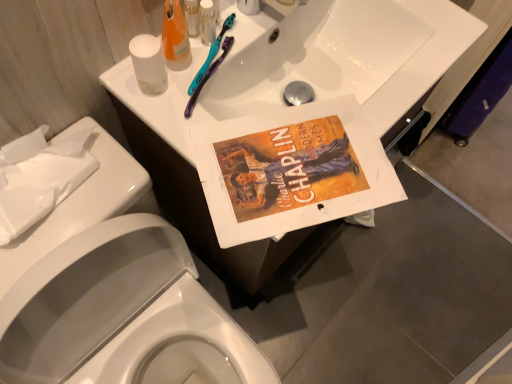
Question: In the image, is clear plastic bottle at upper center, which ranks as the second toiletry in left-to-right order, on the left side or the right side of white glossy porcelain at upper center, the first porcelain when ordered from front to back?

Choices:
 (A) left
 (B) right

Answer: (B)

Question: Is clear plastic bottle at upper center, placed as the 1th toiletry when sorted from right to left, situated inside white glossy porcelain at upper center, which ranks as the 2th porcelain in back-to-front order, or outside?

Choices:
 (A) inside
 (B) outside

Answer: (B)

Question: Which object is the closest to the transparent plastic cup at upper left?

Choices:
 (A) white glossy sink at upper center
 (B) translucent orange liquid at upper center
 (C) white paper towel at left, the 1th porcelain in the back-to-front sequence
 (D) clear plastic bottle at upper center, placed as the 1th toiletry when sorted from right to left
 (E) white glossy porcelain at upper center, the first porcelain when ordered from front to back

Answer: (B)

Question: Which object is the closest to the transparent plastic cup at upper left?

Choices:
 (A) white glossy porcelain at upper center, the first porcelain when ordered from front to back
 (B) translucent plastic bottle at upper center, which is the first toiletry from left to right
 (C) white glossy sink at upper center
 (D) translucent orange liquid at upper center
 (E) clear plastic bottle at upper center, placed as the 1th toiletry when sorted from right to left

Answer: (D)